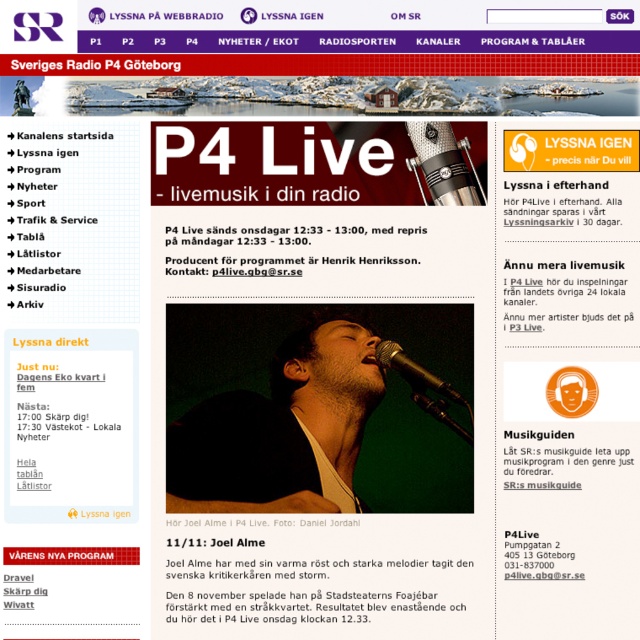
Question: Does dark matte jacket at center have a greater width compared to metallic shiny microphone at center?

Choices:
 (A) no
 (B) yes

Answer: (B)

Question: Among these objects, which one is nearest to the camera?

Choices:
 (A) silver metallic microphone at center
 (B) metallic shiny microphone at center
 (C) dark matte jacket at center

Answer: (C)

Question: Does dark matte jacket at center have a greater width compared to silver metallic microphone at center?

Choices:
 (A) no
 (B) yes

Answer: (B)

Question: Is dark matte jacket at center positioned behind metallic shiny microphone at center?

Choices:
 (A) no
 (B) yes

Answer: (A)

Question: Which object appears closest to the camera in this image?

Choices:
 (A) metallic shiny microphone at center
 (B) silver metallic microphone at center
 (C) dark matte jacket at center

Answer: (C)

Question: Which of the following is the closest to the observer?

Choices:
 (A) (376, 458)
 (B) (390, 348)
 (C) (456, 172)

Answer: (B)